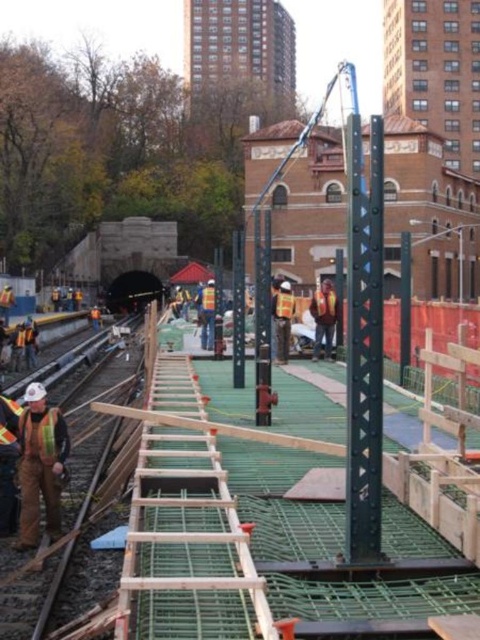
Question: Is green wooden scaffolding at center to the right of reflective orange safety vest at lower left from the viewer's perspective?

Choices:
 (A) no
 (B) yes

Answer: (B)

Question: Can you confirm if green wooden scaffolding at center is bigger than reflective safety vest at left?

Choices:
 (A) yes
 (B) no

Answer: (A)

Question: From the image, what is the correct spatial relationship of reflective safety vest at left in relation to reflective orange safety vest at lower left?

Choices:
 (A) right
 (B) left

Answer: (B)

Question: Which of the following is the closest to the observer?

Choices:
 (A) click(333, 566)
 (B) click(22, 490)
 (C) click(60, 452)

Answer: (A)

Question: Which point is farther from the camera taking this photo?

Choices:
 (A) (186, 360)
 (B) (52, 422)
 (C) (54, 532)

Answer: (A)

Question: Estimate the real-world distances between objects in this image. Which object is farther from the reflective safety vest at left?

Choices:
 (A) green wooden scaffolding at center
 (B) reflective orange safety vest at lower left

Answer: (A)